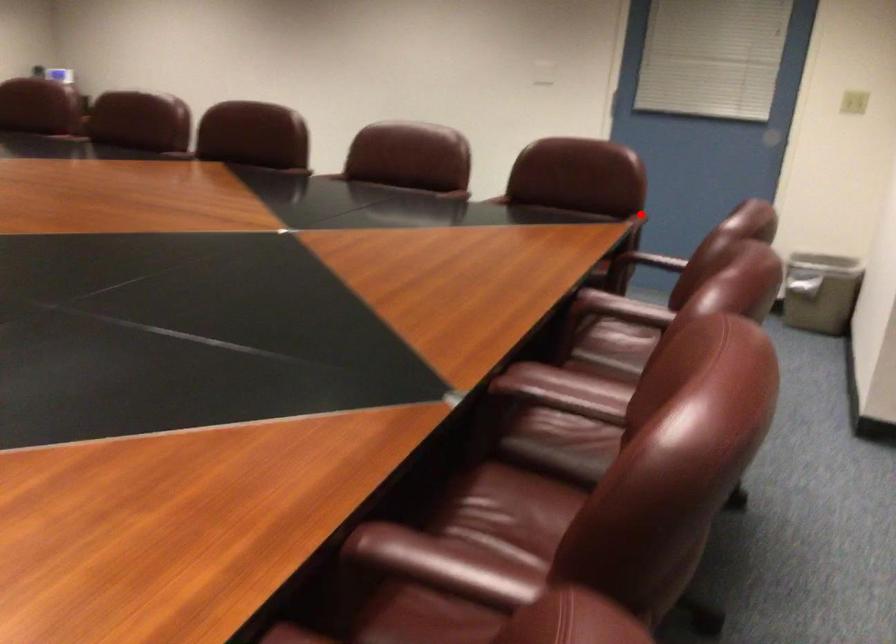
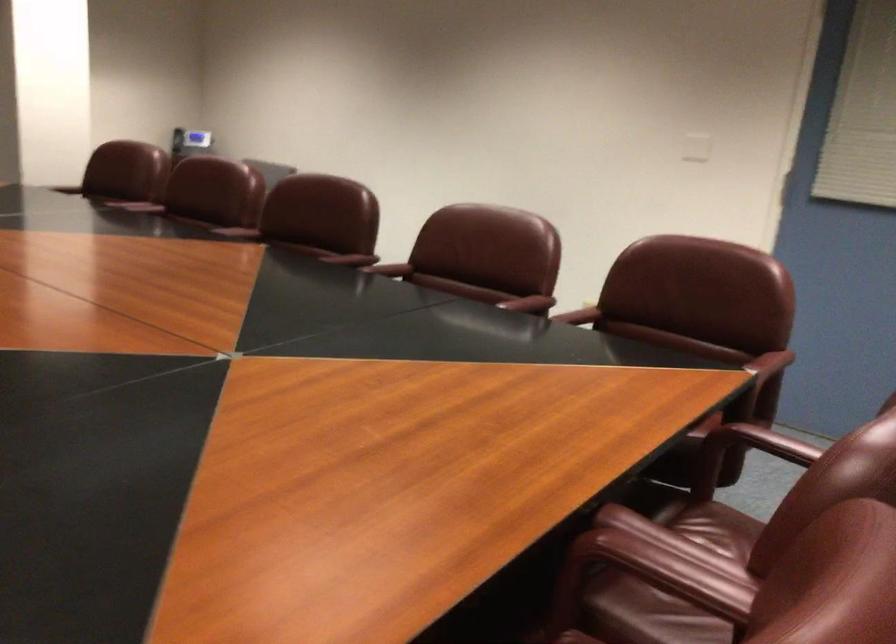
Question: A red point is marked in image1. In image2, is the corresponding 3D point closer to the camera or farther? Reply with the corresponding letter.

Choices:
 (A) The corresponding 3D point is closer.
 (B) The corresponding 3D point is farther.

Answer: (A)